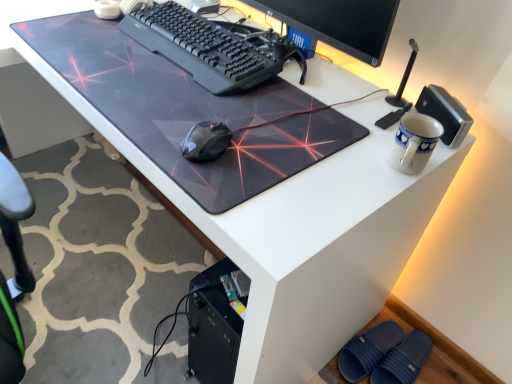
This screenshot has width=512, height=384. In order to click on free space to the left of blue ceramic mug at upper right in this screenshot , I will do `click(322, 149)`.